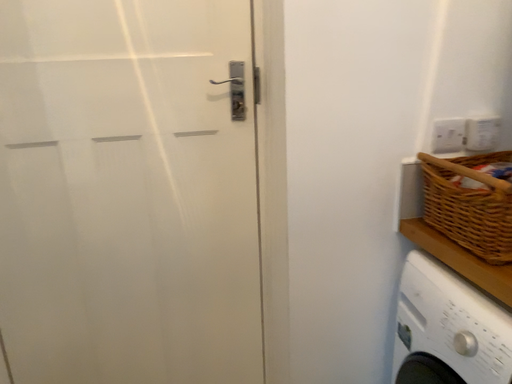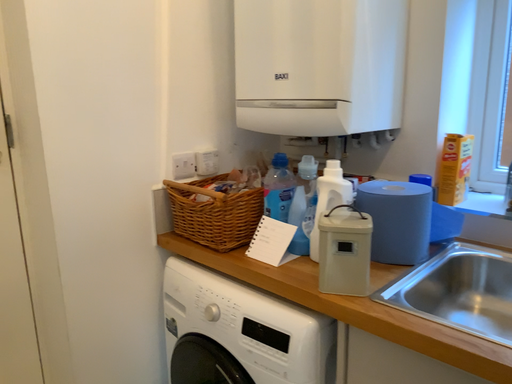
Question: Which way did the camera rotate in the video?

Choices:
 (A) rotated upward
 (B) rotated downward

Answer: (A)